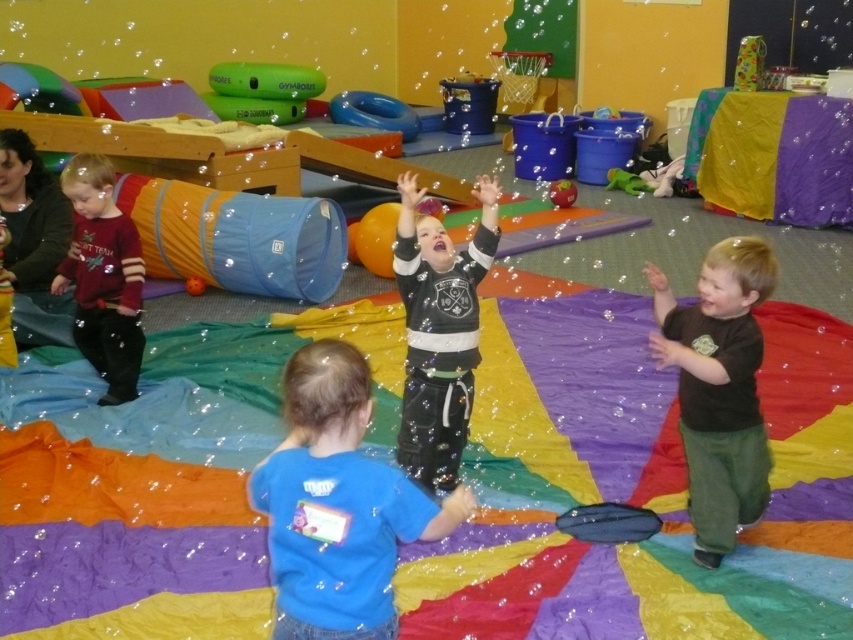
You are a parent trying to locate your child in the daycare. You remember seeing them near the blue rubber ring at upper center and the orange matte ball at center. Which object is higher up in the image?

The blue rubber ring at upper center is located above the orange matte ball at center, so it is higher up in the image.